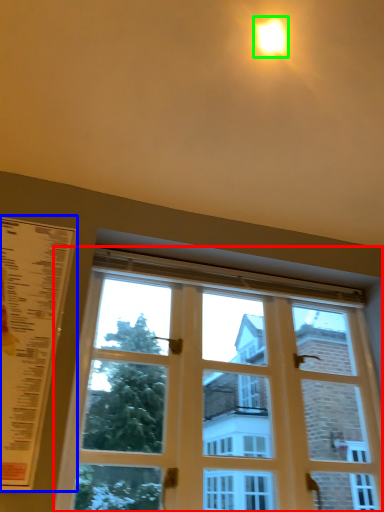
Question: Which is nearer to the window (highlighted by a red box)? menu (highlighted by a blue box) or light (highlighted by a green box).

Choices:
 (A) menu
 (B) light

Answer: (A)